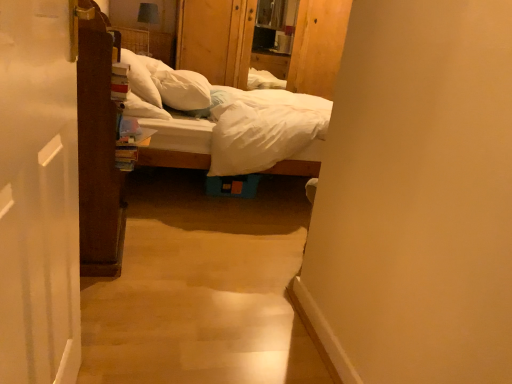
At what (x,y) coordinates should I click in order to perform the action: click on white soft pillow at upper center, arranged as the first pillow when viewed from the left. Please return your answer as a coordinate pair (x, y). Image resolution: width=512 pixels, height=384 pixels. Looking at the image, I should click on (140, 79).

What are the coordinates of `wooden dresser at center` in the screenshot? It's located at (216, 39).

I want to click on white cotton bed at center, so click(164, 121).

The width and height of the screenshot is (512, 384). Identify the location of white soft pillow at upper center, marked as the 2th pillow in a right-to-left arrangement. (140, 79).

In terms of height, does white cotton bed at center look taller or shorter compared to white soft pillow at upper center, arranged as the first pillow when viewed from the left?

Clearly, white cotton bed at center is taller compared to white soft pillow at upper center, arranged as the first pillow when viewed from the left.

Between white cotton bed at center and white soft pillow at upper center, marked as the 2th pillow in a right-to-left arrangement, which one has smaller size?

white soft pillow at upper center, marked as the 2th pillow in a right-to-left arrangement, is smaller.

Considering the sizes of objects white cotton bed at center and white soft pillow at upper center, arranged as the first pillow when viewed from the left, in the image provided, who is wider, white cotton bed at center or white soft pillow at upper center, arranged as the first pillow when viewed from the left,?

white cotton bed at center is wider.

In the image, is white soft pillow at upper center, marked as the 2th pillow in a right-to-left arrangement, on the left side or the right side of white soft pillow at center, the 2th pillow viewed from the left?

In the image, white soft pillow at upper center, marked as the 2th pillow in a right-to-left arrangement, appears on the left side of white soft pillow at center, the 2th pillow viewed from the left.

From a real-world perspective, is white soft pillow at upper center, marked as the 2th pillow in a right-to-left arrangement, beneath white soft pillow at center, the 2th pillow viewed from the left?

No.

Can white soft pillow at center, which is the first pillow in right-to-left order, be found inside white soft pillow at upper center, marked as the 2th pillow in a right-to-left arrangement?

That's incorrect, white soft pillow at center, which is the first pillow in right-to-left order, is not inside white soft pillow at upper center, marked as the 2th pillow in a right-to-left arrangement.

Identify the location of pillow that is the 1st one when counting backward from the white cotton bed at center. (140, 79).

Is white soft pillow at upper center, marked as the 2th pillow in a right-to-left arrangement, looking in the opposite direction of white cotton bed at center?

Absolutely, white soft pillow at upper center, marked as the 2th pillow in a right-to-left arrangement, is directed away from white cotton bed at center.

From the picture: Is white cotton bed at center located within white soft pillow at upper center, arranged as the first pillow when viewed from the left?

That's incorrect, white cotton bed at center is not inside white soft pillow at upper center, arranged as the first pillow when viewed from the left.

From the image's perspective, which is above, white soft pillow at upper center, marked as the 2th pillow in a right-to-left arrangement, or white cotton bed at center?

white soft pillow at upper center, marked as the 2th pillow in a right-to-left arrangement.

Considering the relative sizes of white soft pillow at center, which is the first pillow in right-to-left order, and wooden dresser at center in the image provided, is white soft pillow at center, which is the first pillow in right-to-left order, shorter than wooden dresser at center?

Yes, white soft pillow at center, which is the first pillow in right-to-left order, is shorter than wooden dresser at center.

Is white soft pillow at center, which is the first pillow in right-to-left order, positioned far away from wooden dresser at center?

Yes.

Which is correct: white soft pillow at center, which is the first pillow in right-to-left order, is inside wooden dresser at center, or outside of it?

white soft pillow at center, which is the first pillow in right-to-left order, is outside wooden dresser at center.

This screenshot has width=512, height=384. In order to click on bed to the left of wooden dresser at center in this screenshot , I will do `click(164, 121)`.

Is wooden dresser at center bigger than white cotton bed at center?

No, wooden dresser at center is not bigger than white cotton bed at center.

Is there a large distance between wooden dresser at center and white cotton bed at center?

That's right, there is a large distance between wooden dresser at center and white cotton bed at center.

Is white cotton bed at center at the back of wooden dresser at center?

No.

Considering the positions of objects white soft pillow at center, which is the first pillow in right-to-left order, and white soft pillow at upper center, marked as the 2th pillow in a right-to-left arrangement, in the image provided, who is behind, white soft pillow at center, which is the first pillow in right-to-left order, or white soft pillow at upper center, marked as the 2th pillow in a right-to-left arrangement,?

white soft pillow at center, which is the first pillow in right-to-left order, is further from the camera.

Visually, is white soft pillow at center, the 2th pillow viewed from the left, positioned to the left or to the right of white soft pillow at upper center, arranged as the first pillow when viewed from the left?

white soft pillow at center, the 2th pillow viewed from the left, is to the right of white soft pillow at upper center, arranged as the first pillow when viewed from the left.

Which is closer, (207,90) or (132,60)?

Point (207,90) is positioned closer to the camera compared to point (132,60).

Based on the photo, how far apart are white soft pillow at center, which is the first pillow in right-to-left order, and white soft pillow at upper center, arranged as the first pillow when viewed from the left?

white soft pillow at center, which is the first pillow in right-to-left order, is 5.71 inches away from white soft pillow at upper center, arranged as the first pillow when viewed from the left.

In terms of size, does white cotton bed at center appear bigger or smaller than white soft pillow at center, which is the first pillow in right-to-left order?

Clearly, white cotton bed at center is larger in size than white soft pillow at center, which is the first pillow in right-to-left order.

Considering the positions of objects white cotton bed at center and white soft pillow at center, the 2th pillow viewed from the left, in the image provided, who is behind, white cotton bed at center or white soft pillow at center, the 2th pillow viewed from the left,?

white soft pillow at center, the 2th pillow viewed from the left, is more distant.

Is white cotton bed at center looking in the opposite direction of white soft pillow at center, which is the first pillow in right-to-left order?

Yes, white cotton bed at center is positioned with its back facing white soft pillow at center, which is the first pillow in right-to-left order.

Are white cotton bed at center and white soft pillow at center, the 2th pillow viewed from the left, located far from each other?

white cotton bed at center is actually quite close to white soft pillow at center, the 2th pillow viewed from the left.

Image resolution: width=512 pixels, height=384 pixels. Find the location of `bed that is on the right side of white soft pillow at upper center, marked as the 2th pillow in a right-to-left arrangement`. bed that is on the right side of white soft pillow at upper center, marked as the 2th pillow in a right-to-left arrangement is located at coordinates (164, 121).

The image size is (512, 384). In order to click on pillow in front of the white soft pillow at center, which is the first pillow in right-to-left order in this screenshot , I will do `click(140, 79)`.

Estimate the real-world distances between objects in this image. Which object is closer to wooden dresser at center, white cotton bed at center or white soft pillow at center, which is the first pillow in right-to-left order?

white soft pillow at center, which is the first pillow in right-to-left order, is positioned closer to the anchor wooden dresser at center.

Which object lies nearer to the anchor point white soft pillow at center, which is the first pillow in right-to-left order, wooden dresser at center or white soft pillow at upper center, arranged as the first pillow when viewed from the left?

white soft pillow at upper center, arranged as the first pillow when viewed from the left.

In the scene shown: Based on their spatial positions, is white soft pillow at upper center, marked as the 2th pillow in a right-to-left arrangement, or wooden dresser at center closer to white cotton bed at center?

The object closer to white cotton bed at center is white soft pillow at upper center, marked as the 2th pillow in a right-to-left arrangement.

When comparing their distances from white cotton bed at center, does white soft pillow at center, which is the first pillow in right-to-left order, or wooden dresser at center seem further?

wooden dresser at center lies further to white cotton bed at center than the other object.

From the picture: Based on their spatial positions, is white cotton bed at center or white soft pillow at upper center, marked as the 2th pillow in a right-to-left arrangement, further from wooden dresser at center?

white cotton bed at center.

When comparing their distances from white soft pillow at upper center, marked as the 2th pillow in a right-to-left arrangement, does white cotton bed at center or white soft pillow at center, which is the first pillow in right-to-left order, seem closer?

white cotton bed at center is closer to white soft pillow at upper center, marked as the 2th pillow in a right-to-left arrangement.

Based on their spatial positions, is wooden dresser at center or white cotton bed at center further from white soft pillow at center, which is the first pillow in right-to-left order?

wooden dresser at center is positioned further to the anchor white soft pillow at center, which is the first pillow in right-to-left order.

Which object lies nearer to the anchor point white soft pillow at center, the 2th pillow viewed from the left, white soft pillow at upper center, marked as the 2th pillow in a right-to-left arrangement, or wooden dresser at center?

Based on the image, white soft pillow at upper center, marked as the 2th pillow in a right-to-left arrangement, appears to be nearer to white soft pillow at center, the 2th pillow viewed from the left.

Where is `pillow positioned between white soft pillow at upper center, arranged as the first pillow when viewed from the left, and wooden dresser at center from near to far`? The height and width of the screenshot is (384, 512). pillow positioned between white soft pillow at upper center, arranged as the first pillow when viewed from the left, and wooden dresser at center from near to far is located at coordinates (183, 89).

At what (x,y) coordinates should I click in order to perform the action: click on pillow between white soft pillow at upper center, marked as the 2th pillow in a right-to-left arrangement, and white cotton bed at center from left to right. Please return your answer as a coordinate pair (x, y). Looking at the image, I should click on (183, 89).